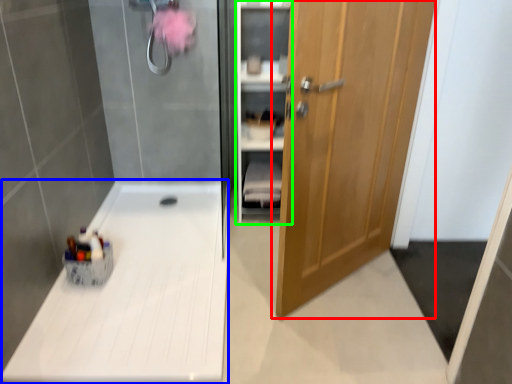
Question: Which object is the closest to the door (highlighted by a red box)? Choose among these: counter top (highlighted by a blue box) or cabinet (highlighted by a green box).

Choices:
 (A) counter top
 (B) cabinet

Answer: (B)